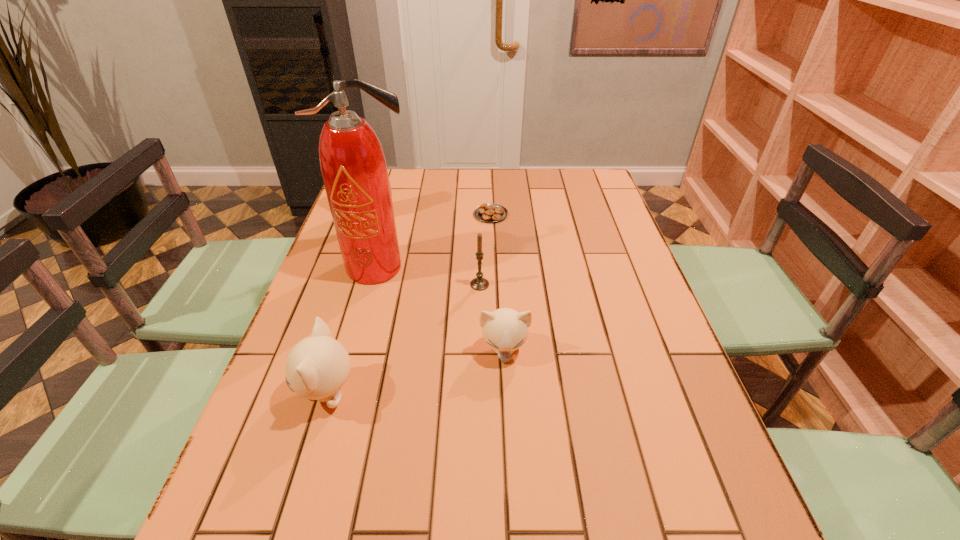
At what (x,y) coordinates should I click in order to perform the action: click on free space between the fire extinguisher and the taller kitten. Please return your answer as a coordinate pair (x, y). Looking at the image, I should click on (353, 330).

In order to click on vacant space that's between the detergent and the shortest object in this screenshot , I will do `click(431, 214)`.

Find the location of a particular element. The width and height of the screenshot is (960, 540). free space between the candle and the taller kitten is located at coordinates (403, 338).

Identify the location of vacant space that's between the shorter kitten and the taller kitten. The height and width of the screenshot is (540, 960). (416, 371).

Locate an element on the screen. free space between the taller kitten and the pastry is located at coordinates (409, 303).

This screenshot has height=540, width=960. I want to click on vacant point located between the fire extinguisher and the shorter kitten, so click(441, 309).

The width and height of the screenshot is (960, 540). Identify the location of free space that is in between the left kitten and the tallest object. (353, 330).

Locate an element on the screen. This screenshot has height=540, width=960. free space that is in between the candle and the detergent is located at coordinates (426, 249).

The height and width of the screenshot is (540, 960). What are the coordinates of `free space between the fifth tallest object and the pastry` in the screenshot? It's located at (497, 282).

Point out which object is positioned as the second nearest to the tallest object. Please provide its 2D coordinates. Your answer should be formatted as a tuple, i.e. [(x, y)], where the tuple contains the x and y coordinates of a point satisfying the conditions above.

[(389, 180)]